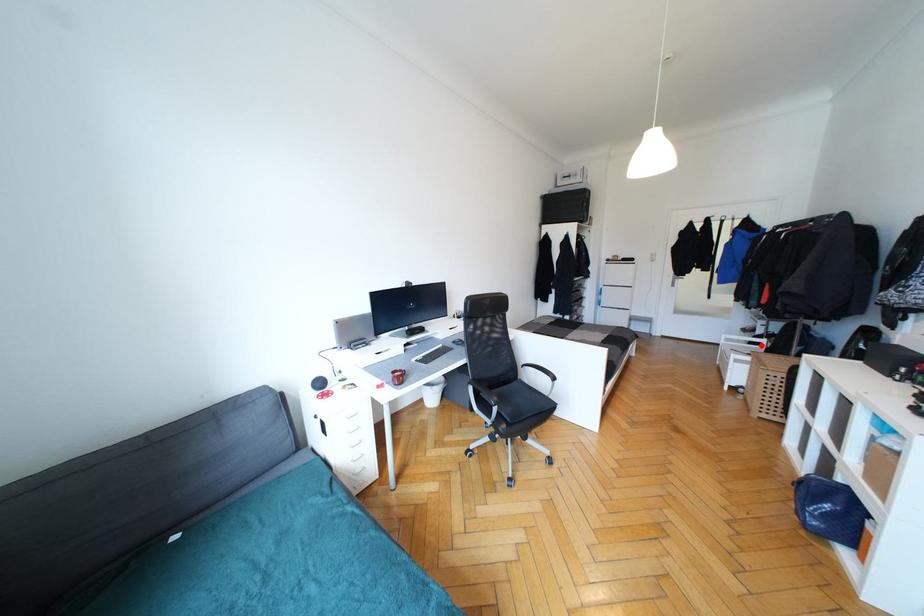
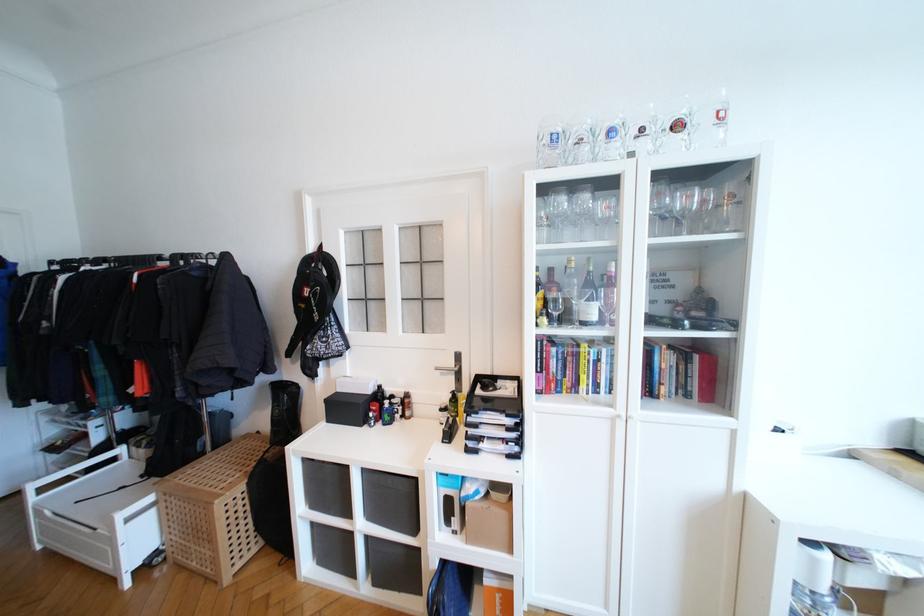
In the second image, find the point that corresponds to the highlighted location in the first image.

(116, 461)